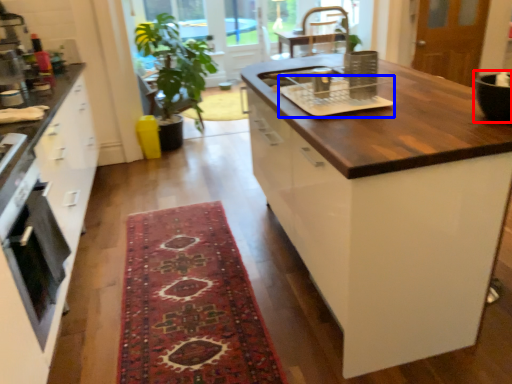
Question: Which point is closer to the camera, appliance (highlighted by a red box) or appliance (highlighted by a blue box)?

Choices:
 (A) appliance
 (B) appliance

Answer: (A)